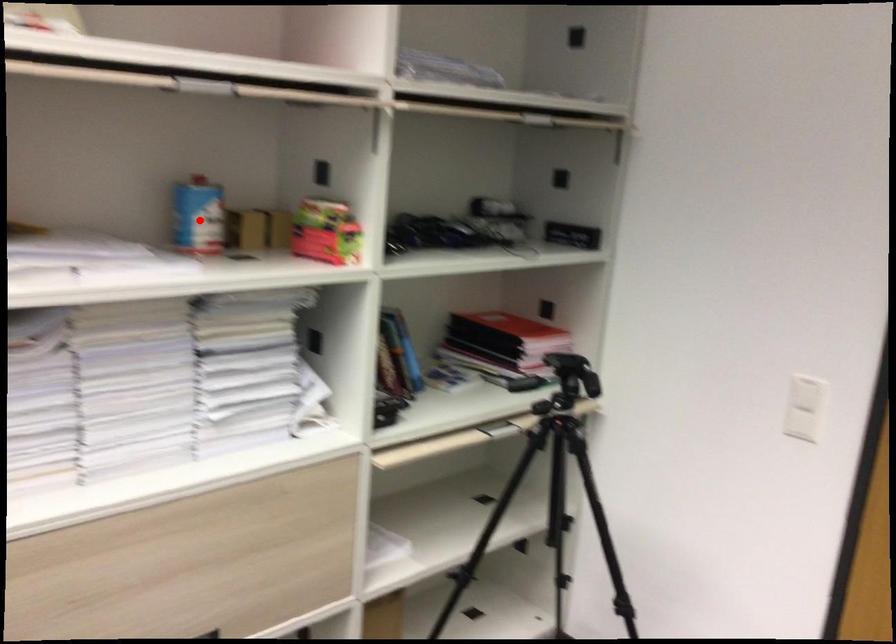
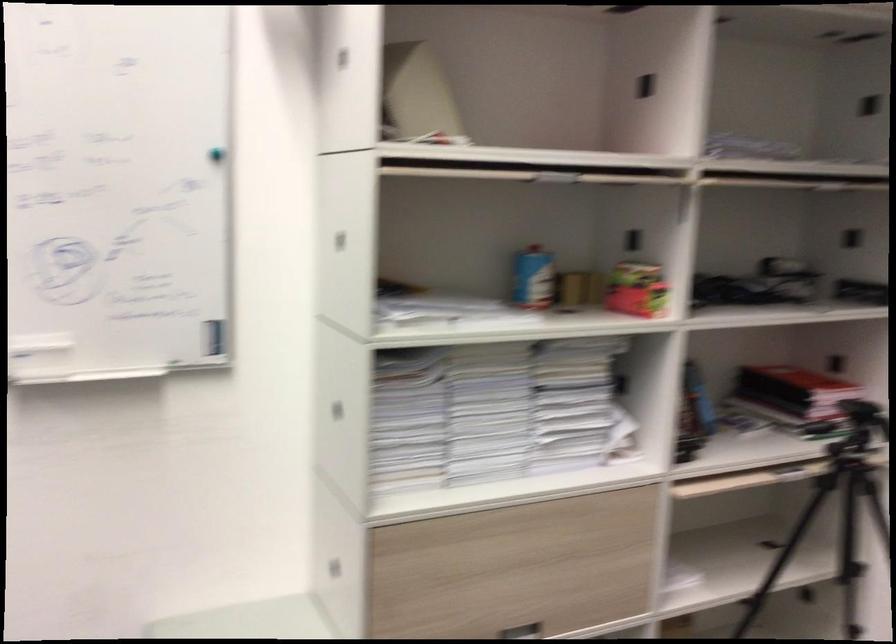
Question: A red point is marked in image1. In image2, is the corresponding 3D point closer to the camera or farther? Reply with the corresponding letter.

Choices:
 (A) The corresponding 3D point is closer.
 (B) The corresponding 3D point is farther.

Answer: (B)